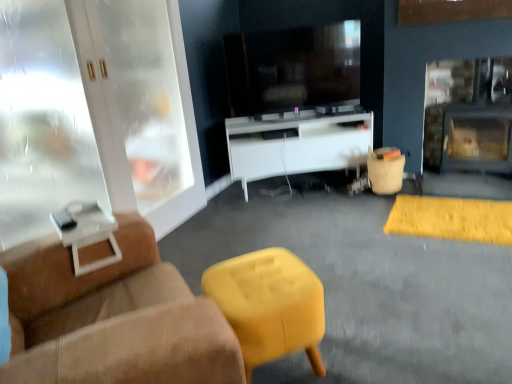
What is the approximate width of suede ottoman at lower center?

It is 2.26 meters.

What do you see at coordinates (293, 68) in the screenshot?
I see `matte black television at center` at bounding box center [293, 68].

This screenshot has width=512, height=384. Identify the location of white glossy cabinet at center. (297, 144).

The height and width of the screenshot is (384, 512). What do you see at coordinates (114, 318) in the screenshot?
I see `suede brown studio couch at left` at bounding box center [114, 318].

What do you see at coordinates (469, 116) in the screenshot?
I see `matte black fireplace at right` at bounding box center [469, 116].

Find the location of a particular element. The height and width of the screenshot is (384, 512). suede ottoman at lower center is located at coordinates (367, 287).

Could you tell me if white glossy cabinet at center is facing bamboo basket at right, which is the first bar stool from back to front?

Yes, white glossy cabinet at center is facing bamboo basket at right, which is the first bar stool from back to front.

From a real-world perspective, between white glossy cabinet at center and bamboo basket at right, marked as the 2th bar stool in a left-to-right arrangement, who is vertically lower?

bamboo basket at right, marked as the 2th bar stool in a left-to-right arrangement, from a real-world perspective.

Looking at this image, considering the relative sizes of white glossy cabinet at center and bamboo basket at right, the 1th bar stool positioned from the top, in the image provided, is white glossy cabinet at center wider than bamboo basket at right, the 1th bar stool positioned from the top,?

Indeed, white glossy cabinet at center has a greater width compared to bamboo basket at right, the 1th bar stool positioned from the top.

Is white glossy cabinet at center taller or shorter than bamboo basket at right, the second bar stool when ordered from bottom to top?

In the image, white glossy cabinet at center appears to be taller than bamboo basket at right, the second bar stool when ordered from bottom to top.

From the picture: Are matte black fireplace at right and white glossy cabinet at center making contact?

No, matte black fireplace at right is not making contact with white glossy cabinet at center.

Measure the distance from matte black fireplace at right to white glossy cabinet at center.

They are 35.42 inches apart.

Is matte black fireplace at right positioned beyond the bounds of white glossy cabinet at center?

Absolutely, matte black fireplace at right is external to white glossy cabinet at center.

Considering the relative sizes of matte black fireplace at right and white glossy cabinet at center in the image provided, is matte black fireplace at right bigger than white glossy cabinet at center?

No.

Is bamboo basket at right, the second bar stool when ordered from bottom to top, positioned with its back to matte black fireplace at right?

No.

From the picture: Which of these two, bamboo basket at right, which is the first bar stool from back to front, or matte black fireplace at right, is smaller?

With smaller size is bamboo basket at right, which is the first bar stool from back to front.

From the picture: Are bamboo basket at right, which is the 1th bar stool in right-to-left order, and matte black fireplace at right located far from each other?

They are positioned close to each other.

Measure the distance between bamboo basket at right, marked as the 2th bar stool in a left-to-right arrangement, and matte black fireplace at right.

bamboo basket at right, marked as the 2th bar stool in a left-to-right arrangement, is 70.77 centimeters away from matte black fireplace at right.

Does matte black fireplace at right have a greater width compared to suede ottoman at lower center?

No.

From the image's perspective, is matte black fireplace at right positioned above or below suede ottoman at lower center?

Clearly, from the image's perspective, matte black fireplace at right is above suede ottoman at lower center.

Would you say matte black fireplace at right contains suede ottoman at lower center?

No, suede ottoman at lower center is not a part of matte black fireplace at right.

Is white glossy cabinet at left not inside white glossy cabinet at center?

white glossy cabinet at left is positioned outside white glossy cabinet at center.

In terms of width, does white glossy cabinet at left look wider or thinner when compared to white glossy cabinet at center?

Clearly, white glossy cabinet at left has less width compared to white glossy cabinet at center.

Is there a large distance between white glossy cabinet at left and white glossy cabinet at center?

They are positioned close to each other.

From the image's perspective, relative to white glossy cabinet at center, is white glossy cabinet at left above or below?

Based on their image positions, white glossy cabinet at left is located above white glossy cabinet at center.

In terms of width, does matte black television at center look wider or thinner when compared to white glossy cabinet at center?

Considering their sizes, matte black television at center looks slimmer than white glossy cabinet at center.

From the image's perspective, is matte black television at center under white glossy cabinet at center?

Incorrect, from the image's perspective, matte black television at center is higher than white glossy cabinet at center.

Considering the positions of points (261, 83) and (292, 150), is point (261, 83) closer to camera compared to point (292, 150)?

Yes, point (261, 83) is closer to viewer.

Can you confirm if matte black television at center is shorter than white glossy cabinet at center?

No, matte black television at center is not shorter than white glossy cabinet at center.

What's the angular difference between matte black fireplace at right and white glossy cabinet at left's facing directions?

They differ by 93.2 degrees in their facing directions.

Are matte black fireplace at right and white glossy cabinet at left making contact?

No, matte black fireplace at right is not in contact with white glossy cabinet at left.

Is point (442, 69) closer or farther from the camera than point (149, 185)?

Point (442, 69) is farther from the camera than point (149, 185).

Is matte black fireplace at right wider than white glossy cabinet at left?

Yes, matte black fireplace at right is wider than white glossy cabinet at left.

From a real-world perspective, count 1st bar stools downward from the white glossy cabinet at center and point to it. Please provide its 2D coordinates.

[(385, 170)]

The height and width of the screenshot is (384, 512). I want to click on fireplace lying in front of the white glossy cabinet at center, so click(x=469, y=116).

Based on their spatial positions, is suede brown studio couch at left or bamboo basket at right, marked as the 2th bar stool in a left-to-right arrangement, further from white glossy cabinet at center?

suede brown studio couch at left is positioned further to the anchor white glossy cabinet at center.

Which object lies nearer to the anchor point matte black television at center, suede brown studio couch at left or matte yellow stool at center, the 2th bar stool viewed from the right?

Among the two, matte yellow stool at center, the 2th bar stool viewed from the right, is located nearer to matte black television at center.

When comparing their distances from white glossy cabinet at center, does matte yellow stool at center, which is the 1th bar stool in left-to-right order, or suede ottoman at lower center seem closer?

suede ottoman at lower center lies closer to white glossy cabinet at center than the other object.

Based on their spatial positions, is white glossy cabinet at left or matte yellow stool at center, the 1th bar stool in the bottom-to-top sequence, further from matte black fireplace at right?

Among the two, matte yellow stool at center, the 1th bar stool in the bottom-to-top sequence, is located further to matte black fireplace at right.

From the image, which object appears to be nearer to suede ottoman at lower center, matte yellow stool at center, the second bar stool viewed from the top, or white glossy cabinet at left?

Among the two, matte yellow stool at center, the second bar stool viewed from the top, is located nearer to suede ottoman at lower center.

Considering their positions, is suede brown studio couch at left positioned closer to suede ottoman at lower center than bamboo basket at right, which is the 1th bar stool in right-to-left order?

The object closer to suede ottoman at lower center is bamboo basket at right, which is the 1th bar stool in right-to-left order.

Looking at this image, based on their spatial positions, is matte black television at center or suede ottoman at lower center closer to bamboo basket at right, which is the first bar stool from back to front?

matte black television at center lies closer to bamboo basket at right, which is the first bar stool from back to front, than the other object.

Based on their spatial positions, is matte black television at center or suede brown studio couch at left closer to matte black fireplace at right?

matte black television at center is closer to matte black fireplace at right.

Locate an element on the screen. Image resolution: width=512 pixels, height=384 pixels. television located between suede ottoman at lower center and white glossy cabinet at center in the depth direction is located at coordinates (293, 68).

Identify the location of television between white glossy cabinet at left and bamboo basket at right, which appears as the second bar stool when viewed from the front. Image resolution: width=512 pixels, height=384 pixels. (293, 68).

The width and height of the screenshot is (512, 384). What are the coordinates of `bar stool situated between matte black television at center and matte black fireplace at right from left to right` in the screenshot? It's located at (385, 170).

Find the location of a particular element. television between white glossy cabinet at left and white glossy cabinet at center from left to right is located at coordinates (293, 68).